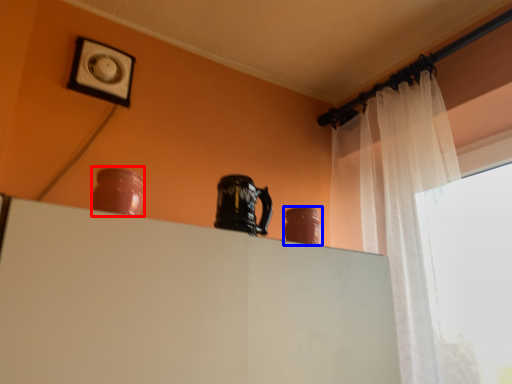
Question: Which object appears closest to the camera in this image, vase (highlighted by a red box) or vase (highlighted by a blue box)?

Choices:
 (A) vase
 (B) vase

Answer: (A)